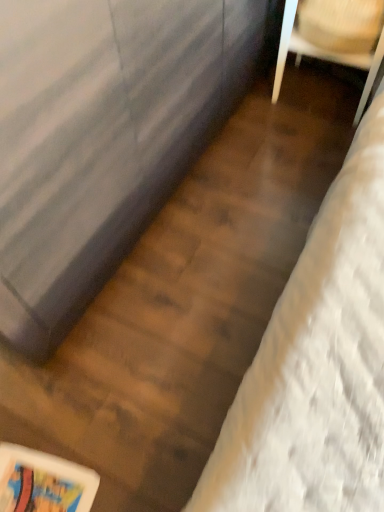
Question: Should I look upward or downward to see wooden chair at upper right?

Choices:
 (A) up
 (B) down

Answer: (A)